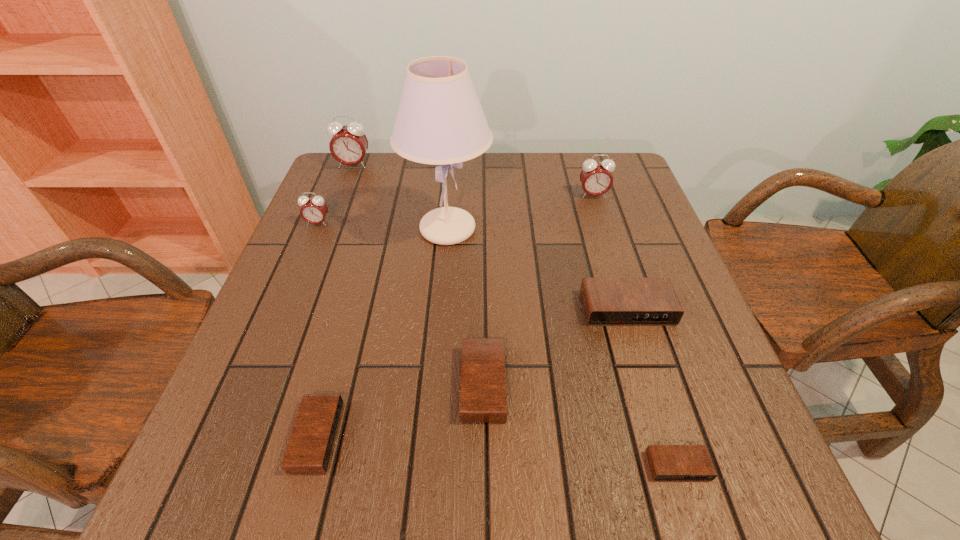
Find the location of a particular element. The image size is (960, 540). vacant space located 0.200m on the front face of the fourth alarm clock from left to right is located at coordinates (348, 384).

You are a GUI agent. You are given a task and a screenshot of the screen. Output one action in this format:
    pyautogui.click(x=<x>, y=<y>)
    Task: Click on the vacant space situated on the front face of the fourth alarm clock from left to right
    
    Given the screenshot: What is the action you would take?
    pyautogui.click(x=241, y=384)

This screenshot has height=540, width=960. Find the location of `vacant space located 0.140m on the front face of the fourth alarm clock from left to right`. vacant space located 0.140m on the front face of the fourth alarm clock from left to right is located at coordinates (382, 384).

You are a GUI agent. You are given a task and a screenshot of the screen. Output one action in this format:
    pyautogui.click(x=<x>, y=<y>)
    Task: Click on the vacant space located on the front face of the leftmost black alarm clock
    The width and height of the screenshot is (960, 540).
    Given the screenshot: What is the action you would take?
    pyautogui.click(x=460, y=436)

This screenshot has height=540, width=960. Find the location of `object located at the far left corner`. object located at the far left corner is located at coordinates (349, 144).

You are a GUI agent. You are given a task and a screenshot of the screen. Output one action in this format:
    pyautogui.click(x=<x>, y=<y>)
    Task: Click on the object located at the near left corner
    The width and height of the screenshot is (960, 540).
    Given the screenshot: What is the action you would take?
    pyautogui.click(x=310, y=445)

Image resolution: width=960 pixels, height=540 pixels. Find the location of `object that is at the far right corner`. object that is at the far right corner is located at coordinates (596, 179).

Where is `object present at the near right corner`? This screenshot has width=960, height=540. object present at the near right corner is located at coordinates (667, 462).

Locate an element on the screen. The image size is (960, 540). vacant area at the far edge of the desktop is located at coordinates (410, 197).

Identify the location of vacant space at the near edge of the desktop. The image size is (960, 540). (521, 470).